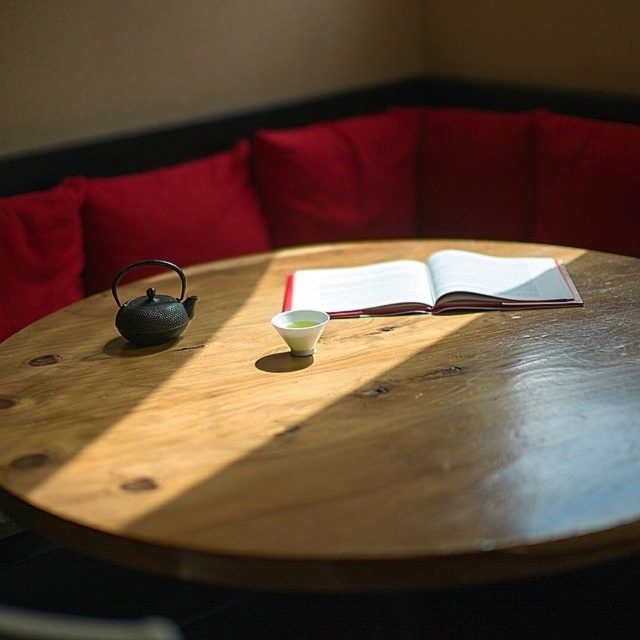
You are arranging a tea ceremony and need to place the black textured teapot at left on the table. However, there is a velvet red pillow at upper left already occupying space. Can the teapot fit next to the pillow without moving it?

The velvet red pillow at upper left is wider than the black textured teapot at left. Since the pillow is already occupying space, there might still be enough room for the teapot next to it, but it depends on the exact dimensions. However, according to the description, the pillow is wider, so if the pillow takes up more space horizontally, placing the teapot next to it might be challenging without moving the pillow.

Looking at this image, you are arranging flowers in the corner setup and need to place a vase between the velvet red pillow at upper left and the black textured teapot at left. Based on their positions, where should you place the vase?

The velvet red pillow at upper left is to the left of the black textured teapot at left, so place the vase between them by positioning it to the right of the velvet red pillow at upper left and to the left of the black textured teapot at left.